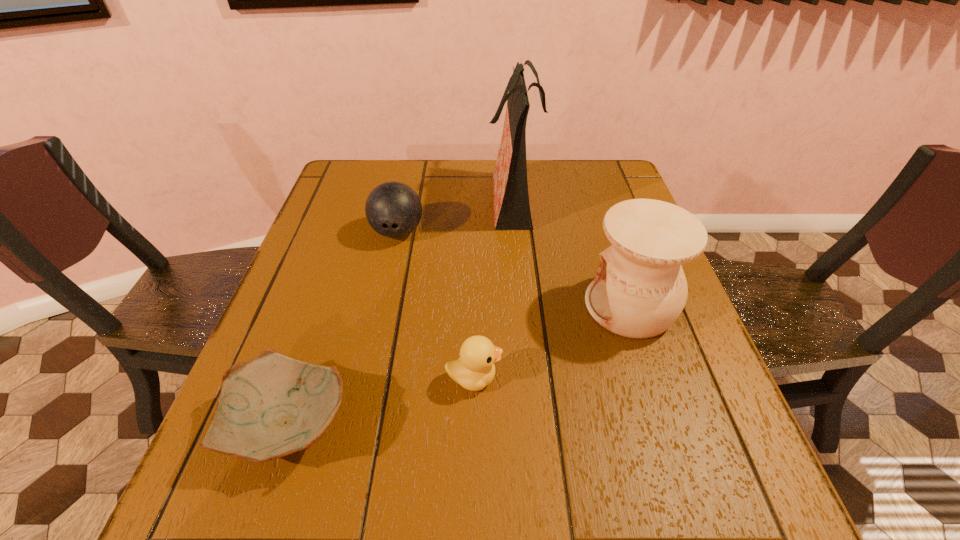
This screenshot has width=960, height=540. I want to click on object present at the right edge, so click(x=640, y=289).

Locate an element on the screen. This screenshot has width=960, height=540. object present at the near left corner is located at coordinates (271, 406).

In the image, there is a desktop. In order to click on blank space at the far edge in this screenshot , I will do `click(467, 169)`.

What are the coordinates of `vacant space at the left edge of the desktop` in the screenshot? It's located at (337, 321).

Find the location of a particular element. This screenshot has height=540, width=960. vacant space at the right edge of the desktop is located at coordinates (676, 442).

Find the location of a particular element. The width and height of the screenshot is (960, 540). vacant space at the near left corner of the desktop is located at coordinates [x=252, y=529].

The image size is (960, 540). Identify the location of free space at the near right corner of the desktop. (709, 476).

Find the location of a particular element. The height and width of the screenshot is (540, 960). free space between the nearer pottery and the duck is located at coordinates (382, 400).

Locate an element on the screen. This screenshot has height=540, width=960. free area in between the left pottery and the fourth tallest object is located at coordinates click(382, 400).

Find the location of `vacant space in between the shortest object and the shopping bag`. vacant space in between the shortest object and the shopping bag is located at coordinates (402, 310).